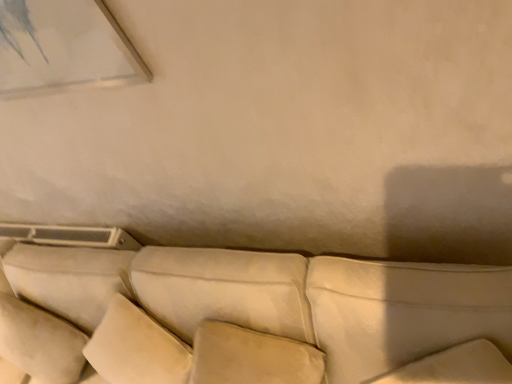
Question: From a real-world perspective, is white leather pillow at lower right, which is counted as the 3th pillow, starting from the left, positioned under suede-like beige couch at center based on gravity?

Choices:
 (A) yes
 (B) no

Answer: (B)

Question: Is white leather pillow at lower right, which ranks as the first pillow in right-to-left order, next to suede-like beige couch at center?

Choices:
 (A) yes
 (B) no

Answer: (B)

Question: Would you consider white leather pillow at lower right, which is counted as the 3th pillow, starting from the left, to be distant from suede-like beige couch at center?

Choices:
 (A) yes
 (B) no

Answer: (B)

Question: Is the depth of white leather pillow at lower right, which is counted as the 3th pillow, starting from the left, greater than that of suede-like beige couch at center?

Choices:
 (A) no
 (B) yes

Answer: (B)

Question: From a real-world perspective, is white leather pillow at lower right, which is counted as the 3th pillow, starting from the left, positioned over suede-like beige couch at center based on gravity?

Choices:
 (A) no
 (B) yes

Answer: (B)

Question: From the image's perspective, would you say white leather pillow at lower right, which ranks as the first pillow in right-to-left order, is positioned over suede-like beige couch at center?

Choices:
 (A) no
 (B) yes

Answer: (B)

Question: Is suede-like beige couch at center located outside white leather pillow at lower right, which is counted as the 3th pillow, starting from the left?

Choices:
 (A) no
 (B) yes

Answer: (B)

Question: Is suede-like beige couch at center oriented away from white leather pillow at lower right, which ranks as the first pillow in right-to-left order?

Choices:
 (A) yes
 (B) no

Answer: (A)

Question: Is suede-like beige couch at center closer to the viewer compared to white leather pillow at lower right, which is counted as the 3th pillow, starting from the left?

Choices:
 (A) yes
 (B) no

Answer: (A)

Question: Does suede-like beige couch at center have a greater width compared to white leather pillow at lower right, which is counted as the 3th pillow, starting from the left?

Choices:
 (A) no
 (B) yes

Answer: (B)

Question: Does suede-like beige couch at center have a smaller size compared to white leather pillow at lower right, which is counted as the 3th pillow, starting from the left?

Choices:
 (A) yes
 (B) no

Answer: (B)

Question: Is suede-like beige couch at center surrounding white leather pillow at lower right, which ranks as the first pillow in right-to-left order?

Choices:
 (A) yes
 (B) no

Answer: (A)

Question: Considering the relative positions of suede-like beige couch at center and suede-like beige pillow at center, the second pillow in the left-to-right sequence, in the image provided, is suede-like beige couch at center to the left of suede-like beige pillow at center, the second pillow in the left-to-right sequence, from the viewer's perspective?

Choices:
 (A) yes
 (B) no

Answer: (A)